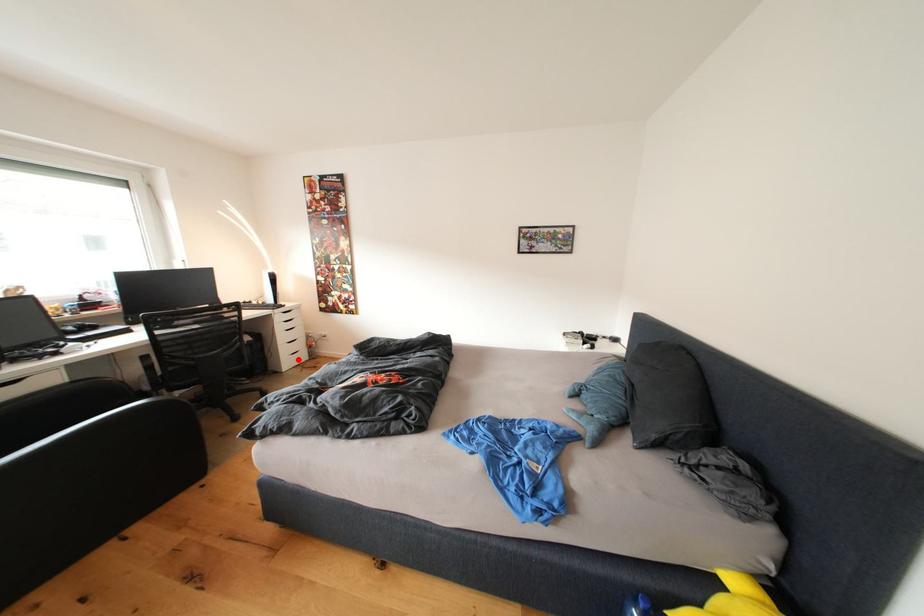
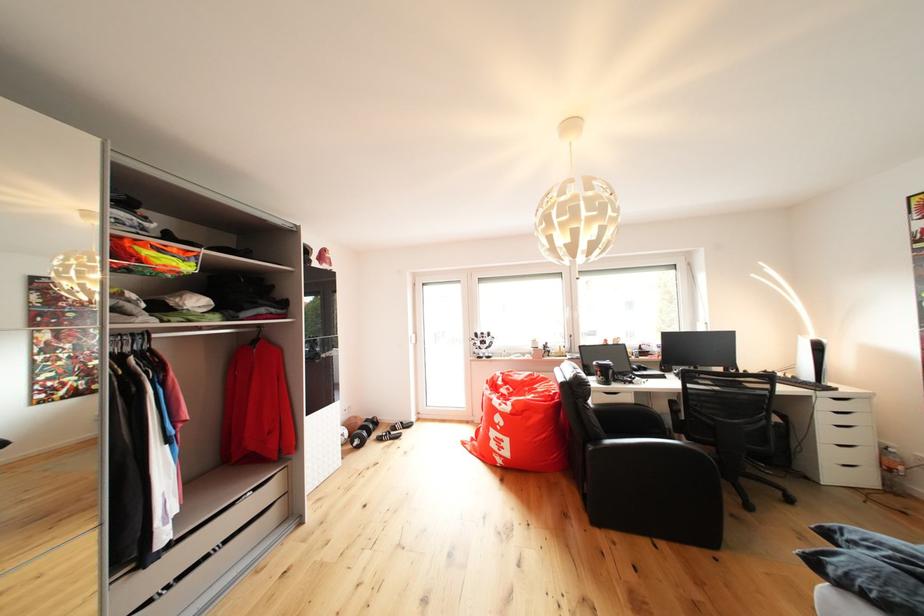
The point at the highlighted location is marked in the first image. Where is the corresponding point in the second image?

(846, 469)